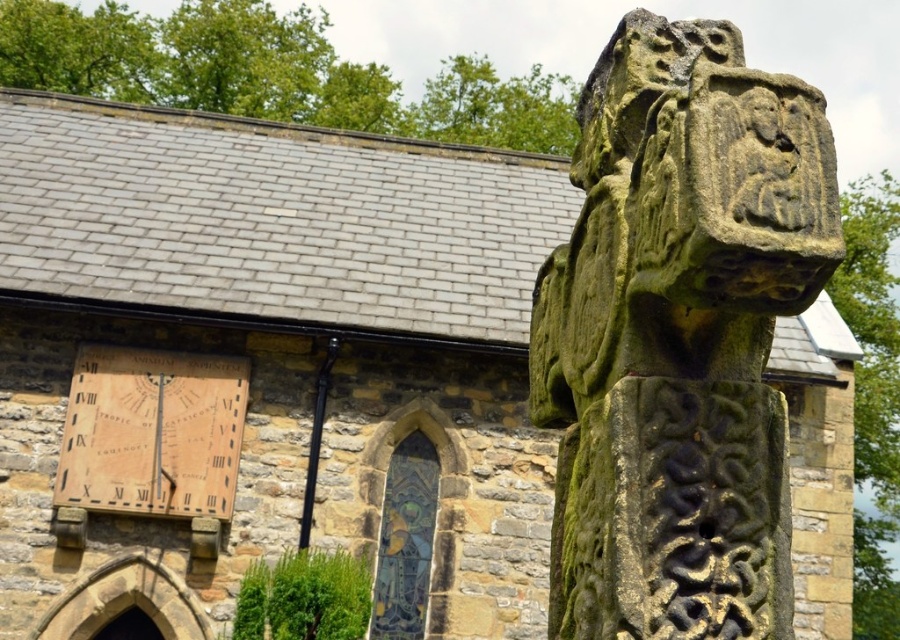
You are an architect examining the stone cross and the wooden sundial in the image. Given that the green mossy stone cross at upper right has a lesser width compared to the wooden sundial at left, which object would require a smaller storage box for transport?

The green mossy stone cross at upper right requires a smaller storage box for transport since it has a lesser width compared to the wooden sundial at left.

You are standing in the historic church courtyard. You see the green mossy stone cross at upper right and the wooden sundial at left. You want to place a 10 meter long banner between them. Will the banner fit between them?

The distance between the green mossy stone cross at upper right and the wooden sundial at left is 9.00 meters. The banner is 10 meters long, so it will not fit between them as the distance is shorter than the banner.